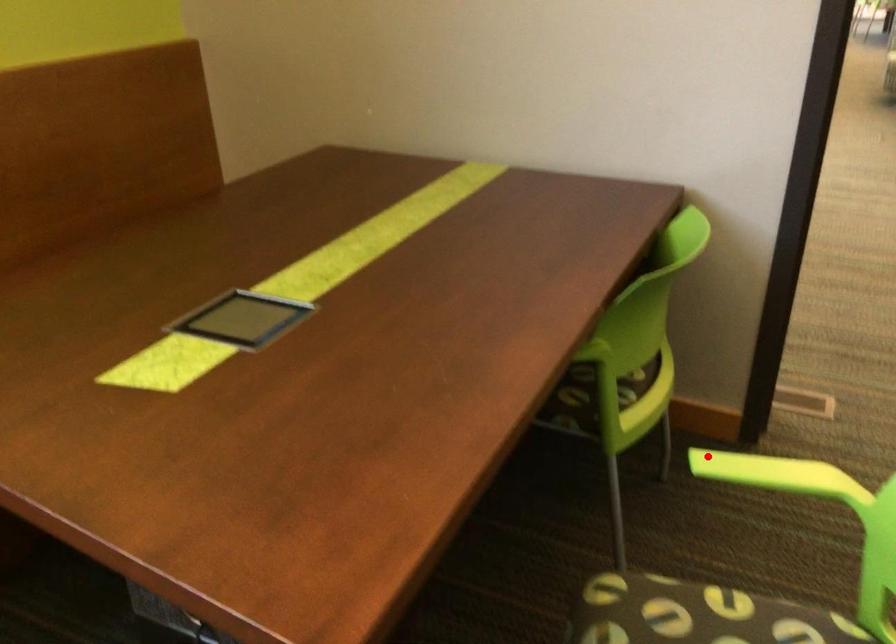
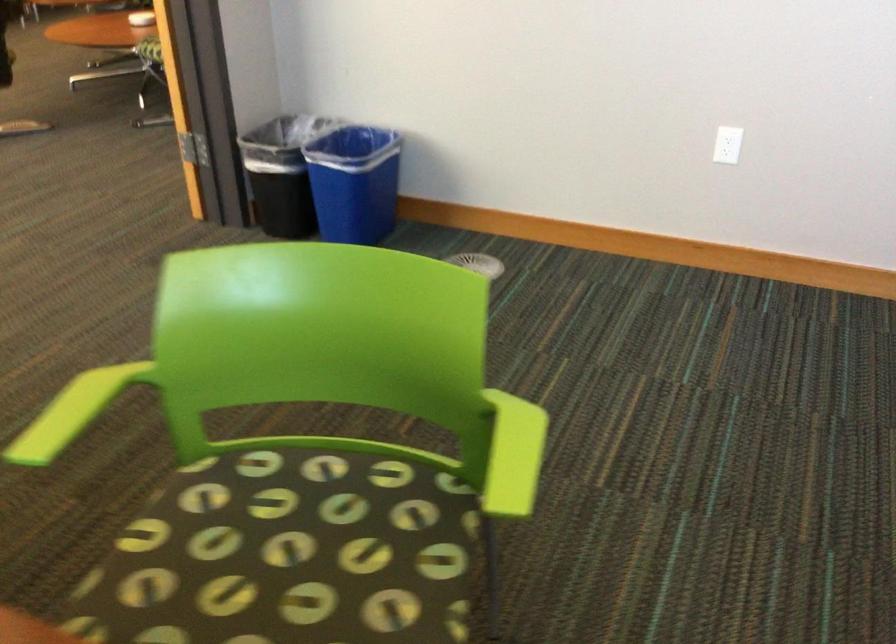
Question: A red point is marked in image1. In image2, is the corresponding 3D point closer to the camera or farther? Reply with the corresponding letter.

Choices:
 (A) The corresponding 3D point is closer.
 (B) The corresponding 3D point is farther.

Answer: (A)